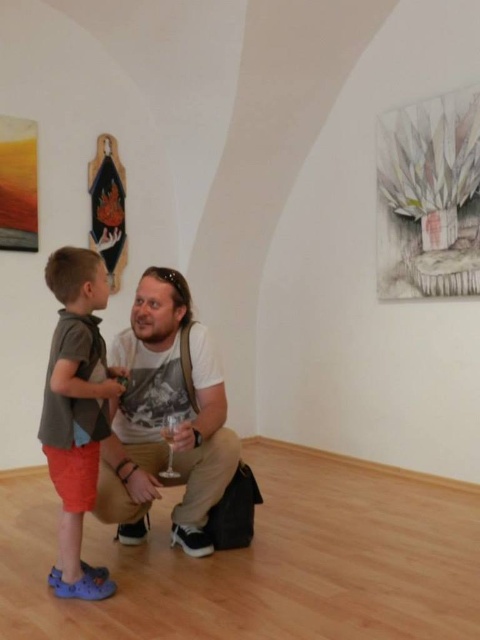
Who is lower down, white cotton t-shirt at center or matte gray shirt at left?

Positioned lower is white cotton t-shirt at center.

Between white cotton t-shirt at center and matte gray shirt at left, which one has more height?

With more height is matte gray shirt at left.

Between point (153, 428) and point (78, 417), which one is positioned behind?

Positioned behind is point (153, 428).

Where is `white cotton t-shirt at center`? The height and width of the screenshot is (640, 480). white cotton t-shirt at center is located at coordinates coord(166,419).